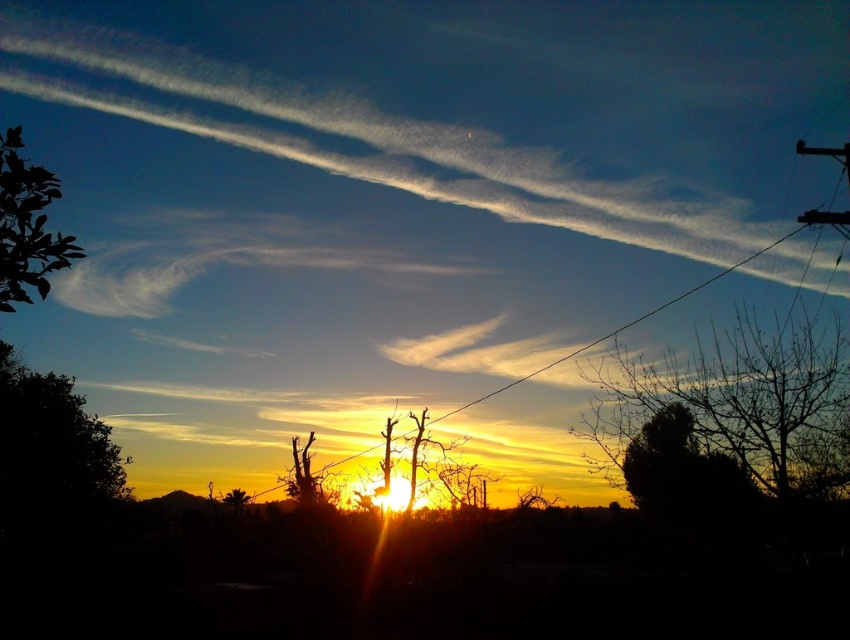
Can you confirm if silhouette bare tree at right is positioned above dark green leafy tree at lower left?

Yes, silhouette bare tree at right is above dark green leafy tree at lower left.

Between silhouette bare tree at right and dark green leafy tree at lower left, which one appears on the right side from the viewer's perspective?

silhouette bare tree at right

Between point (693, 404) and point (74, 429), which one is positioned behind?

The point (74, 429) is more distant.

At what (x,y) coordinates should I click in order to perform the action: click on silhouette bare tree at right. Please return your answer as a coordinate pair (x, y). This screenshot has height=640, width=850. Looking at the image, I should click on (737, 397).

Is white wispy cloud at upper center to the left of black wire at center from the viewer's perspective?

Correct, you'll find white wispy cloud at upper center to the left of black wire at center.

How far apart are white wispy cloud at upper center and black wire at center?

The distance of white wispy cloud at upper center from black wire at center is 30.76 feet.

Is point (701, 195) closer to viewer compared to point (578, 349)?

No, (701, 195) is further to viewer.

At what (x,y) coordinates should I click in order to perform the action: click on white wispy cloud at upper center. Please return your answer as a coordinate pair (x, y). This screenshot has height=640, width=850. Looking at the image, I should click on (472, 99).

Is point (518, 52) closer to camera compared to point (15, 452)?

Yes, it is.

Is white wispy cloud at upper center thinner than dark green leafy tree at lower left?

In fact, white wispy cloud at upper center might be wider than dark green leafy tree at lower left.

Is point (707, 51) less distant than point (48, 428)?

Yes, point (707, 51) is in front of point (48, 428).

Locate an element on the screen. This screenshot has height=640, width=850. white wispy cloud at upper center is located at coordinates (472, 99).